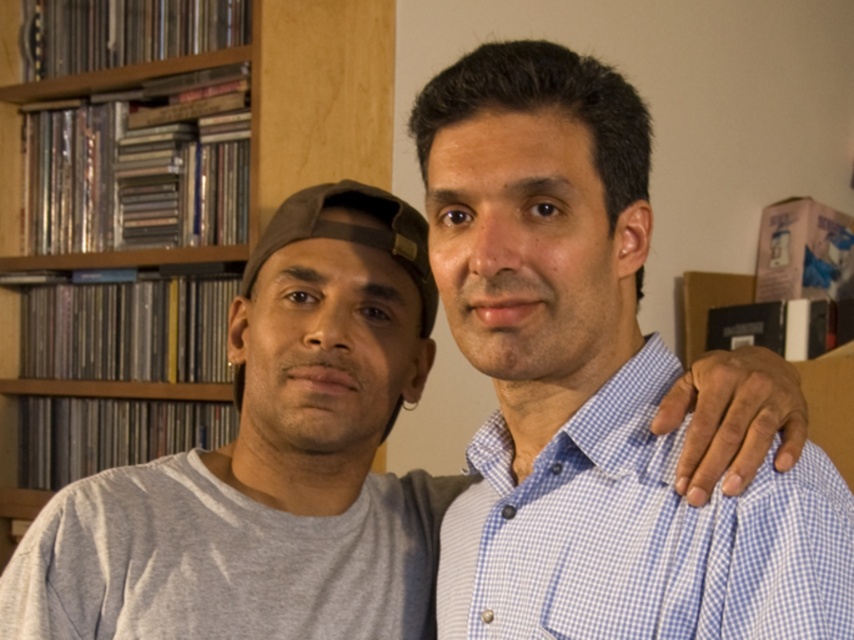
You are holding a 100 centimeter long pole and want to place it from your current position to the point at coordinates point (487, 608). Can the pole reach that point?

The distance of point (487, 608) from the camera is 86.96 centimeters. Since the pole is 100 centimeters long, it can easily reach the point as it is shorter than the pole.

You are trying to determine which object in the image takes up more visual space. You see the blue checkered shirt at center and the wooden bookshelf at upper left. Which one covers more area in the image?

The wooden bookshelf at upper left covers more area in the image because the blue checkered shirt at center occupies less space than it.